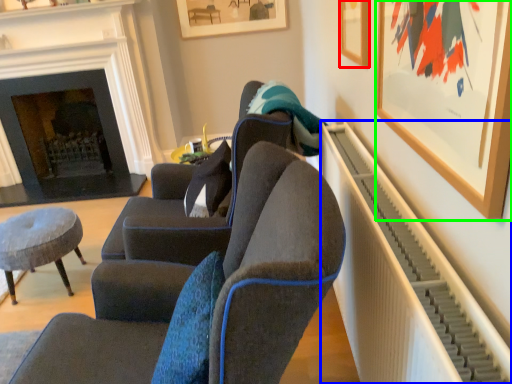
Question: Based on their relative distances, which object is nearer to picture frame (highlighted by a red box)? Choose from radiator (highlighted by a blue box) and picture frame (highlighted by a green box).

Choices:
 (A) radiator
 (B) picture frame

Answer: (B)